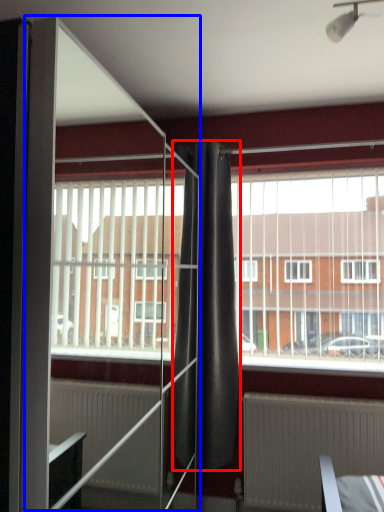
Question: Which object appears farthest to the camera in this image, curtain (highlighted by a red box) or screen door (highlighted by a blue box)?

Choices:
 (A) curtain
 (B) screen door

Answer: (A)